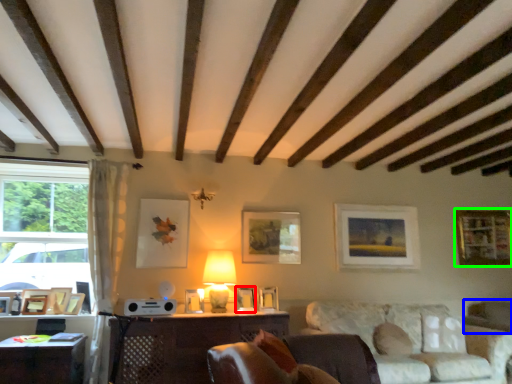
Question: Which is farther away from picture frame (highlighted by a red box)? swivel chair (highlighted by a blue box) or picture frame (highlighted by a green box)?

Choices:
 (A) swivel chair
 (B) picture frame

Answer: (B)